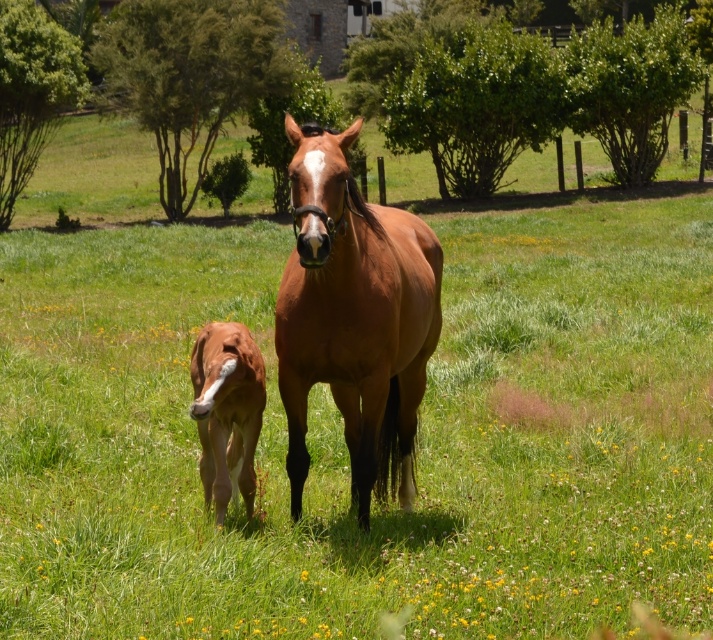
What do you see at coordinates (354, 317) in the screenshot?
I see `brown glossy horse at center` at bounding box center [354, 317].

Consider the image. Is brown glossy horse at center behind brown glossy pony at center?

That is False.

Is point (371, 296) behind point (251, 461)?

No, (371, 296) is closer to viewer.

Identify the location of brown glossy horse at center. The image size is (713, 640). (354, 317).